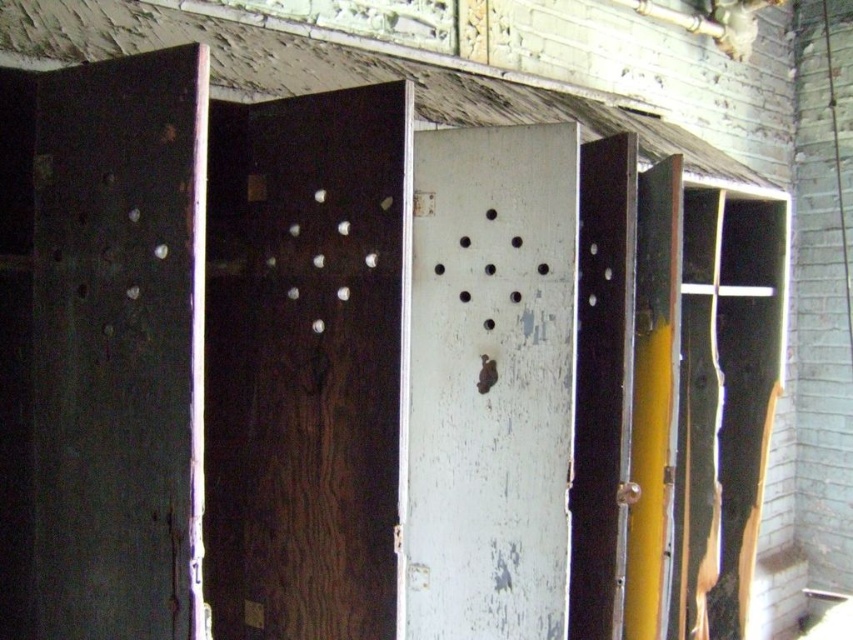
Is dark wood door at center positioned in front of white peeling paint at center?

Yes, dark wood door at center is in front of white peeling paint at center.

In the scene shown: Between dark wood door at center and white peeling paint at center, which one appears on the right side from the viewer's perspective?

Positioned to the right is white peeling paint at center.

Between point (286, 193) and point (422, 401), which one is positioned in front?

Point (286, 193) is more forward.

Identify the location of dark wood door at center. (305, 362).